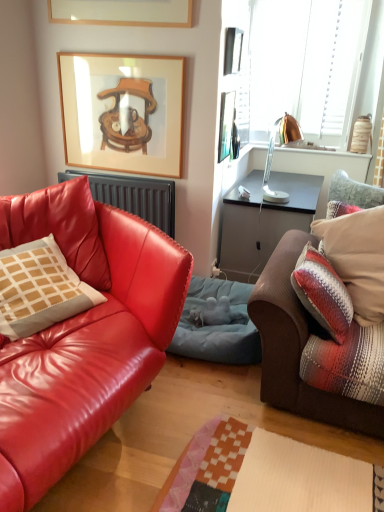
Question: Is matte leather couch at left, the 2th studio couch positioned from the right, thinner than plaid fabric pillow at right, the first pillow positioned from the right?

Choices:
 (A) no
 (B) yes

Answer: (A)

Question: Considering the relative positions of matte leather couch at left, the 2th studio couch positioned from the right, and plaid fabric pillow at right, the 2th pillow in the left-to-right sequence, in the image provided, is matte leather couch at left, the 2th studio couch positioned from the right, in front of plaid fabric pillow at right, the 2th pillow in the left-to-right sequence,?

Choices:
 (A) yes
 (B) no

Answer: (A)

Question: From the image's perspective, would you say matte leather couch at left, the first studio couch in the left-to-right sequence, is positioned over plaid fabric pillow at right, the 2th pillow in the left-to-right sequence?

Choices:
 (A) yes
 (B) no

Answer: (B)

Question: Is matte leather couch at left, the first studio couch in the left-to-right sequence, to the right of plaid fabric pillow at right, the 2th pillow in the left-to-right sequence, from the viewer's perspective?

Choices:
 (A) no
 (B) yes

Answer: (A)

Question: Is matte leather couch at left, the 2th studio couch positioned from the right, shorter than plaid fabric pillow at right, the 2th pillow in the left-to-right sequence?

Choices:
 (A) yes
 (B) no

Answer: (B)

Question: From the image's perspective, does matte leather couch at left, the first studio couch in the left-to-right sequence, appear lower than plaid fabric pillow at right, the first pillow positioned from the right?

Choices:
 (A) no
 (B) yes

Answer: (B)

Question: Does matte black radiator at left have a greater width compared to metallic silver picture frame at upper center, marked as the third picture frame in a left-to-right arrangement?

Choices:
 (A) no
 (B) yes

Answer: (B)

Question: Is matte black radiator at left positioned with its back to metallic silver picture frame at upper center, marked as the third picture frame in a left-to-right arrangement?

Choices:
 (A) no
 (B) yes

Answer: (A)

Question: From the image's perspective, is matte black radiator at left on top of metallic silver picture frame at upper center, acting as the 1th picture frame starting from the right?

Choices:
 (A) yes
 (B) no

Answer: (B)

Question: Can you confirm if matte black radiator at left is smaller than metallic silver picture frame at upper center, marked as the third picture frame in a left-to-right arrangement?

Choices:
 (A) yes
 (B) no

Answer: (B)

Question: From a real-world perspective, is matte black radiator at left on metallic silver picture frame at upper center, marked as the third picture frame in a left-to-right arrangement?

Choices:
 (A) yes
 (B) no

Answer: (B)

Question: Does matte black radiator at left come behind metallic silver picture frame at upper center, acting as the 1th picture frame starting from the right?

Choices:
 (A) no
 (B) yes

Answer: (B)

Question: Could you tell me if copper metallic lamp at upper right is facing matte beige pillow at left, the 1th pillow positioned from the left?

Choices:
 (A) yes
 (B) no

Answer: (B)